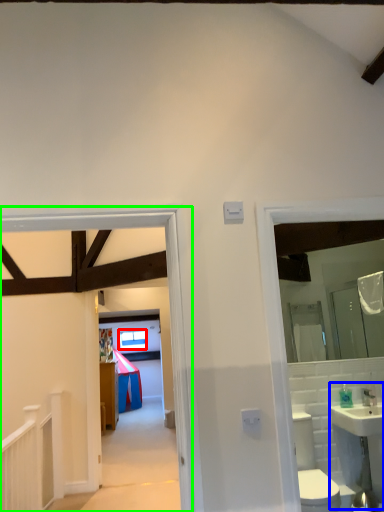
Question: Which object is positioned farthest from window (highlighted by a red box)? Select from sink (highlighted by a blue box) and corridor (highlighted by a green box).

Choices:
 (A) sink
 (B) corridor

Answer: (B)